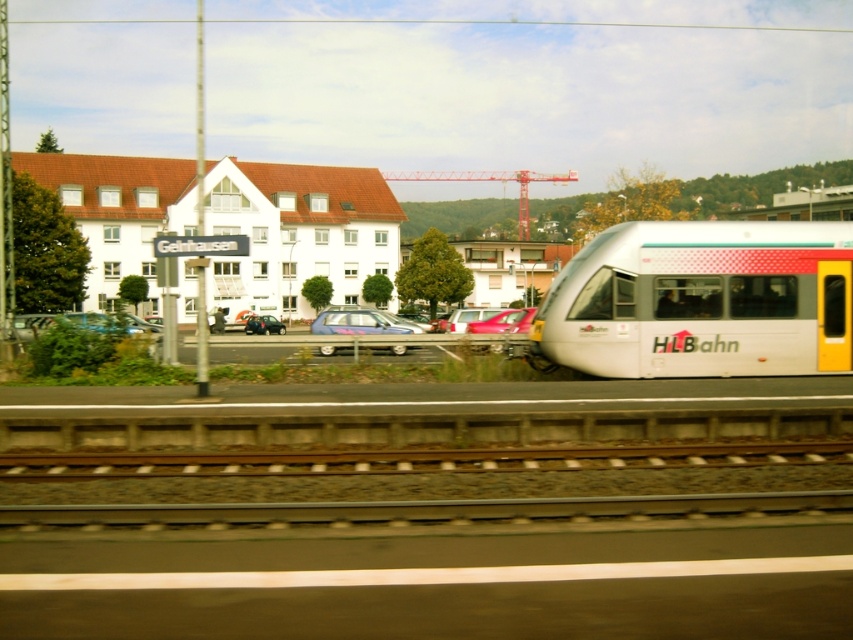
From the picture: You are a parking attendant at the train station. You need to park both the metallic silver car at center and the shiny red sedan at center in a parking spot that is 2 meters wide. Can both vehicles fit side by side in the spot?

The metallic silver car at center might be wider than the shiny red sedan at center. Since the parking spot is only 2 meters wide, there is a possibility that the combined width of both vehicles exceeds the available space. Therefore, it is uncertain if they can fit side by side without overlapping.